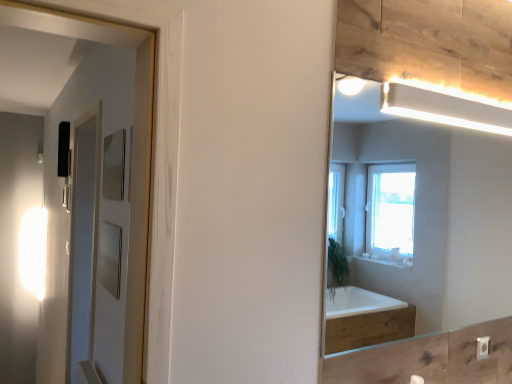
Locate an element on the screen. Image resolution: width=512 pixels, height=384 pixels. transparent glass screen door at left is located at coordinates (96, 251).

Measure the distance between point (100, 225) and camera.

7.07 feet.

Image resolution: width=512 pixels, height=384 pixels. Describe the element at coordinates (96, 251) in the screenshot. I see `transparent glass screen door at left` at that location.

What do you see at coordinates (421, 218) in the screenshot? I see `clear glass mirror at upper right` at bounding box center [421, 218].

Find the location of a particular element. clear glass mirror at upper right is located at coordinates (421, 218).

The image size is (512, 384). Identify the location of transparent glass screen door at left. (96, 251).

Can you confirm if clear glass mirror at upper right is positioned to the left of transparent glass screen door at left?

In fact, clear glass mirror at upper right is to the right of transparent glass screen door at left.

Which object is more forward, clear glass mirror at upper right or transparent glass screen door at left?

clear glass mirror at upper right is closer to the camera.

Is point (468, 175) positioned before point (116, 182)?

No, it is behind (116, 182).

From the image's perspective, is clear glass mirror at upper right below transparent glass screen door at left?

Actually, clear glass mirror at upper right appears above transparent glass screen door at left in the image.

From a real-world perspective, does clear glass mirror at upper right sit lower than transparent glass screen door at left?

No, from a real-world perspective, clear glass mirror at upper right is not under transparent glass screen door at left.

In terms of width, does clear glass mirror at upper right look wider or thinner when compared to transparent glass screen door at left?

Clearly, clear glass mirror at upper right has less width compared to transparent glass screen door at left.

Does clear glass mirror at upper right have a lesser height compared to transparent glass screen door at left?

Yes, clear glass mirror at upper right is shorter than transparent glass screen door at left.

Does clear glass mirror at upper right have a larger size compared to transparent glass screen door at left?

No, clear glass mirror at upper right is not bigger than transparent glass screen door at left.

Is transparent glass screen door at left a part of clear glass mirror at upper right?

No, transparent glass screen door at left is located outside of clear glass mirror at upper right.

Is clear glass mirror at upper right beside transparent glass screen door at left?

No, clear glass mirror at upper right is not next to transparent glass screen door at left.

Could you tell me if clear glass mirror at upper right is facing transparent glass screen door at left?

No, clear glass mirror at upper right is not facing towards transparent glass screen door at left.

What's the angular difference between clear glass mirror at upper right and transparent glass screen door at left's facing directions?

clear glass mirror at upper right and transparent glass screen door at left are facing 91 degrees away from each other.

Image resolution: width=512 pixels, height=384 pixels. In order to click on mirror lying in front of the transparent glass screen door at left in this screenshot , I will do `click(421, 218)`.

Which object is positioned more to the right, transparent glass screen door at left or clear glass mirror at upper right?

From the viewer's perspective, clear glass mirror at upper right appears more on the right side.

Which is in front, transparent glass screen door at left or clear glass mirror at upper right?

Positioned in front is clear glass mirror at upper right.

Considering the positions of point (111, 351) and point (498, 199), is point (111, 351) closer or farther from the camera than point (498, 199)?

Point (111, 351).

From the picture: From the image's perspective, is transparent glass screen door at left located beneath clear glass mirror at upper right?

Indeed, from the image's perspective, transparent glass screen door at left is shown beneath clear glass mirror at upper right.

From a real-world perspective, is transparent glass screen door at left on top of clear glass mirror at upper right?

No, from a real-world perspective, transparent glass screen door at left is not above clear glass mirror at upper right.

Does transparent glass screen door at left have a lesser width compared to clear glass mirror at upper right?

No, transparent glass screen door at left is not thinner than clear glass mirror at upper right.

Can you confirm if transparent glass screen door at left is taller than clear glass mirror at upper right?

Yes, transparent glass screen door at left is taller than clear glass mirror at upper right.

Which of these two, transparent glass screen door at left or clear glass mirror at upper right, is smaller?

With smaller size is clear glass mirror at upper right.

Would you say transparent glass screen door at left is inside or outside clear glass mirror at upper right?

transparent glass screen door at left is located beyond the bounds of clear glass mirror at upper right.

Is transparent glass screen door at left not close to clear glass mirror at upper right?

transparent glass screen door at left is positioned a significant distance from clear glass mirror at upper right.

Is transparent glass screen door at left facing away from clear glass mirror at upper right?

No, transparent glass screen door at left is not facing the opposite direction of clear glass mirror at upper right.

Locate an element on the screen. The image size is (512, 384). mirror on the right side of transparent glass screen door at left is located at coordinates (421, 218).

Image resolution: width=512 pixels, height=384 pixels. Find the location of `screen door on the left of clear glass mirror at upper right`. screen door on the left of clear glass mirror at upper right is located at coordinates click(96, 251).

Where is `mirror on the right side of transparent glass screen door at left`? mirror on the right side of transparent glass screen door at left is located at coordinates (421, 218).